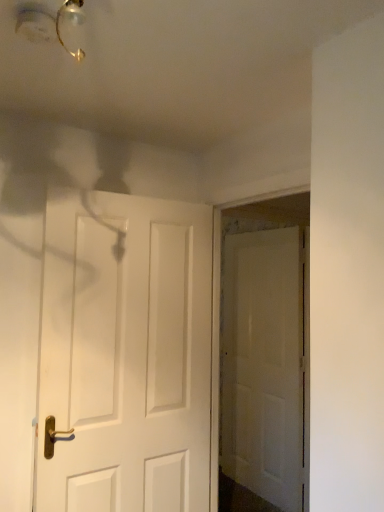
Question: Is white matte door at center, the 2th door from the front, surrounding matte gold light fixture at upper left?

Choices:
 (A) no
 (B) yes

Answer: (A)

Question: Is white matte door at center, the 2th door from the front, taller than matte gold light fixture at upper left?

Choices:
 (A) yes
 (B) no

Answer: (A)

Question: Is white matte door at center, the 2th door from the front, looking in the opposite direction of matte gold light fixture at upper left?

Choices:
 (A) yes
 (B) no

Answer: (B)

Question: Does white matte door at center, which is the 1th door in right-to-left order, have a smaller size compared to matte gold light fixture at upper left?

Choices:
 (A) yes
 (B) no

Answer: (B)

Question: Choose the correct answer: Is white matte door at center, marked as the first door in a front-to-back arrangement, inside white matte door at center, which is the 1th door in right-to-left order, or outside it?

Choices:
 (A) inside
 (B) outside

Answer: (B)

Question: Is white matte door at center, acting as the first door starting from the left, in front of or behind white matte door at center, placed as the first door when sorted from back to front, in the image?

Choices:
 (A) front
 (B) behind

Answer: (A)

Question: Looking at their shapes, would you say white matte door at center, the 2th door in the right-to-left sequence, is wider or thinner than white matte door at center, placed as the first door when sorted from back to front?

Choices:
 (A) thin
 (B) wide

Answer: (B)

Question: From the image's perspective, is white matte door at center, acting as the first door starting from the left, above or below white matte door at center, placed as the first door when sorted from back to front?

Choices:
 (A) below
 (B) above

Answer: (B)

Question: From the image's perspective, is white matte door at center, the 2th door from the front, above or below matte gold light fixture at upper left?

Choices:
 (A) below
 (B) above

Answer: (A)

Question: Considering the positions of white matte door at center, which is the 1th door in right-to-left order, and matte gold light fixture at upper left in the image, is white matte door at center, which is the 1th door in right-to-left order, taller or shorter than matte gold light fixture at upper left?

Choices:
 (A) tall
 (B) short

Answer: (A)

Question: Considering the relative positions of white matte door at center, which is the 1th door in right-to-left order, and matte gold light fixture at upper left in the image provided, is white matte door at center, which is the 1th door in right-to-left order, to the left or to the right of matte gold light fixture at upper left?

Choices:
 (A) left
 (B) right

Answer: (B)

Question: In terms of size, does white matte door at center, which is the 1th door in right-to-left order, appear bigger or smaller than matte gold light fixture at upper left?

Choices:
 (A) small
 (B) big

Answer: (B)

Question: Is white matte door at center, the 2th door from the front, wider or thinner than white matte door at center, acting as the first door starting from the left?

Choices:
 (A) wide
 (B) thin

Answer: (B)

Question: Is point (230, 425) positioned closer to the camera than point (71, 207)?

Choices:
 (A) closer
 (B) farther

Answer: (B)